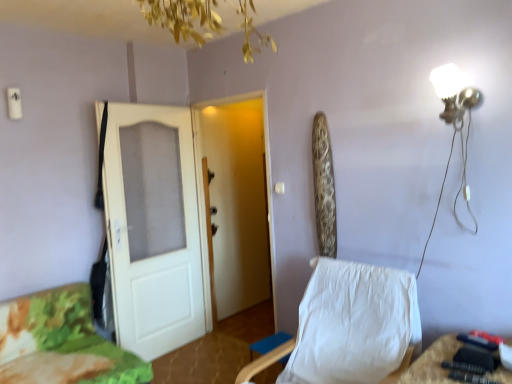
I want to click on free location to the right of white matte door at left, which appears as the 1th door when viewed from the left, so click(x=207, y=354).